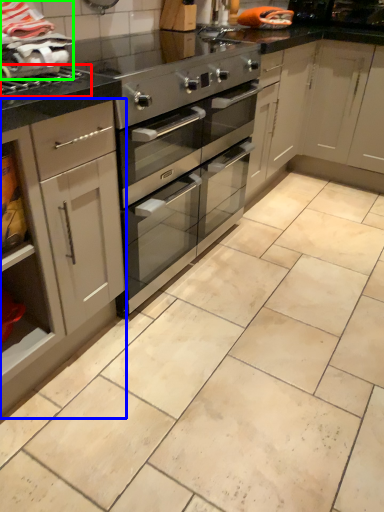
Question: Estimate the real-world distances between objects in this image. Which object is closer to gas stove (highlighted by a red box), cabinetry (highlighted by a blue box) or material (highlighted by a green box)?

Choices:
 (A) cabinetry
 (B) material

Answer: (B)